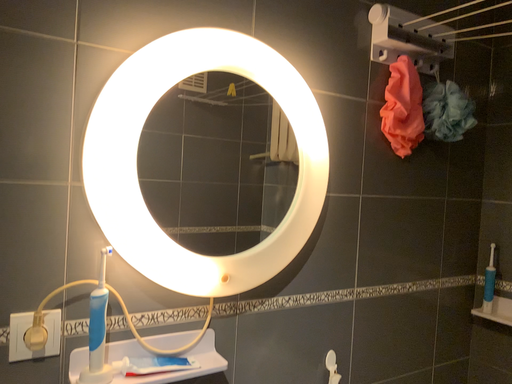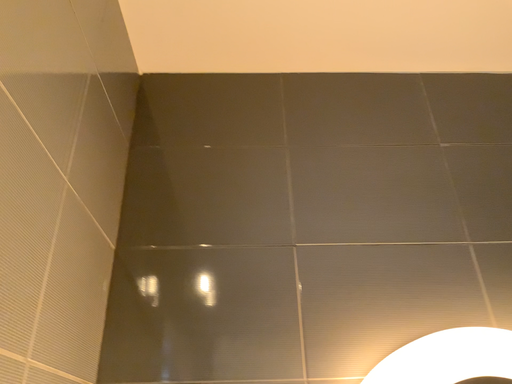
Question: Which way did the camera rotate in the video?

Choices:
 (A) rotated left
 (B) rotated right

Answer: (A)